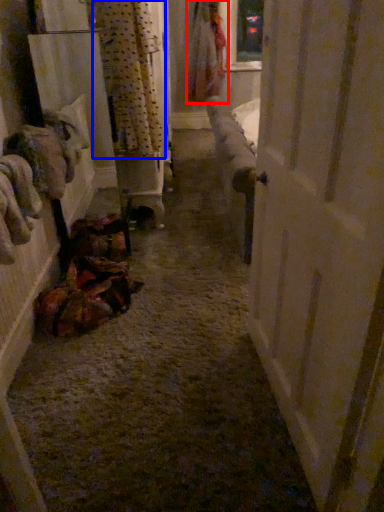
Question: Which object appears closest to the camera in this image, clothing (highlighted by a red box) or curtain (highlighted by a blue box)?

Choices:
 (A) clothing
 (B) curtain

Answer: (B)